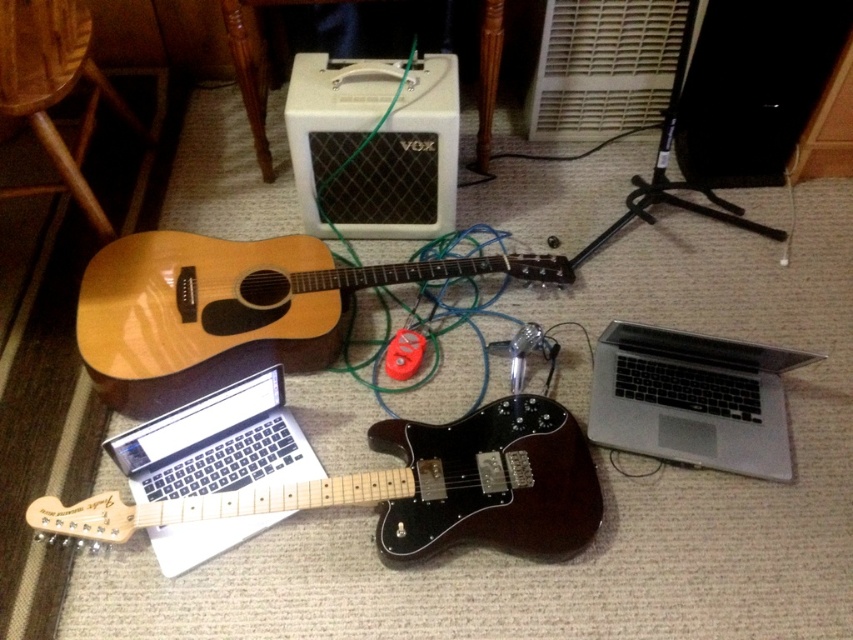
Does black matte speaker at upper right have a smaller size compared to silver metallic laptop at lower left?

No, black matte speaker at upper right is not smaller than silver metallic laptop at lower left.

Does black matte speaker at upper right have a lesser height compared to silver metallic laptop at lower left?

Correct, black matte speaker at upper right is not as tall as silver metallic laptop at lower left.

Which is in front, point (740, 170) or point (265, 440)?

Point (265, 440) is in front.

I want to click on black matte speaker at upper right, so click(753, 86).

Does silver metallic laptop at lower left have a larger size compared to wooden stool at lower left?

Actually, silver metallic laptop at lower left might be smaller than wooden stool at lower left.

Does silver metallic laptop at lower left have a lesser width compared to wooden stool at lower left?

In fact, silver metallic laptop at lower left might be wider than wooden stool at lower left.

Identify the location of silver metallic laptop at lower left. (216, 444).

Is point (368, 200) behind point (619, 328)?

Yes, it is.

Who is taller, white mesh vox amplifier at center or silver metallic laptop at lower right?

With more height is white mesh vox amplifier at center.

Is point (379, 211) in front of point (772, 477)?

No, (379, 211) is further to viewer.

Identify the location of white mesh vox amplifier at center. This screenshot has height=640, width=853. (374, 145).